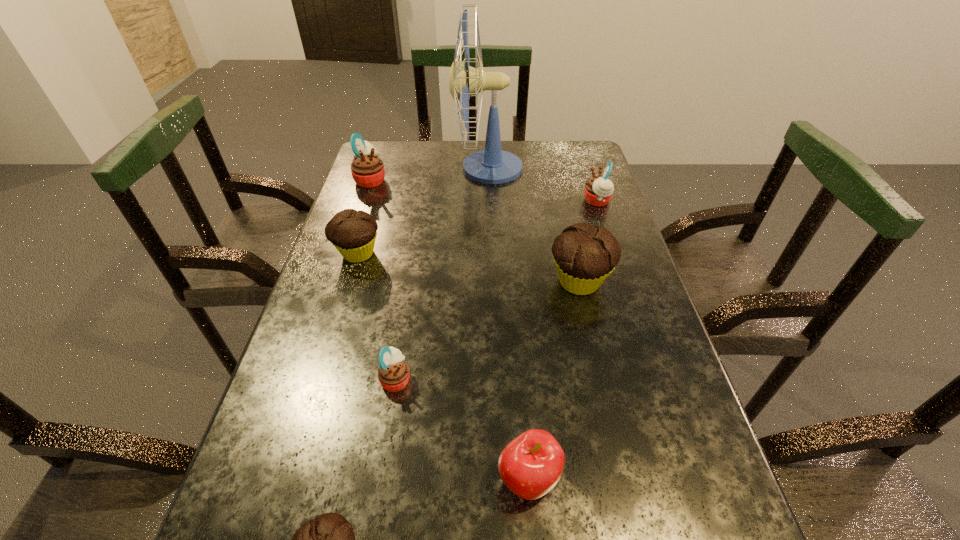
This screenshot has height=540, width=960. What are the coordinates of `empty space that is in between the second biggest chocolate muffin and the second biggest pink muffin` in the screenshot? It's located at (477, 227).

Locate an element on the screen. This screenshot has height=540, width=960. free area in between the sixth farthest object and the rightmost chocolate muffin is located at coordinates (488, 330).

Locate an element on the screen. The width and height of the screenshot is (960, 540). empty location between the second farthest pink muffin and the blue fan is located at coordinates (542, 185).

Image resolution: width=960 pixels, height=540 pixels. In order to click on free area in between the second biggest pink muffin and the nearest pink muffin in this screenshot , I will do `click(496, 290)`.

At what (x,y) coordinates should I click in order to perform the action: click on vacant space that is in between the second biggest chocolate muffin and the apple. Please return your answer as a coordinate pair (x, y). Looking at the image, I should click on (443, 366).

Identify the location of vacant area that lies between the red apple and the second biggest chocolate muffin. The image size is (960, 540). (443, 366).

Locate an element on the screen. empty space between the rightmost chocolate muffin and the fan is located at coordinates (534, 225).

This screenshot has height=540, width=960. Find the location of `object that ranks as the seventh closest to the farthest muffin`. object that ranks as the seventh closest to the farthest muffin is located at coordinates (329, 539).

Locate which object is the fourth closest to the leftmost pink muffin. Please provide its 2D coordinates. Your answer should be formatted as a tuple, i.e. [(x, y)], where the tuple contains the x and y coordinates of a point satisfying the conditions above.

[(598, 190)]

Image resolution: width=960 pixels, height=540 pixels. In order to click on muffin that is the closest one to the tallest object in this screenshot , I will do 598,190.